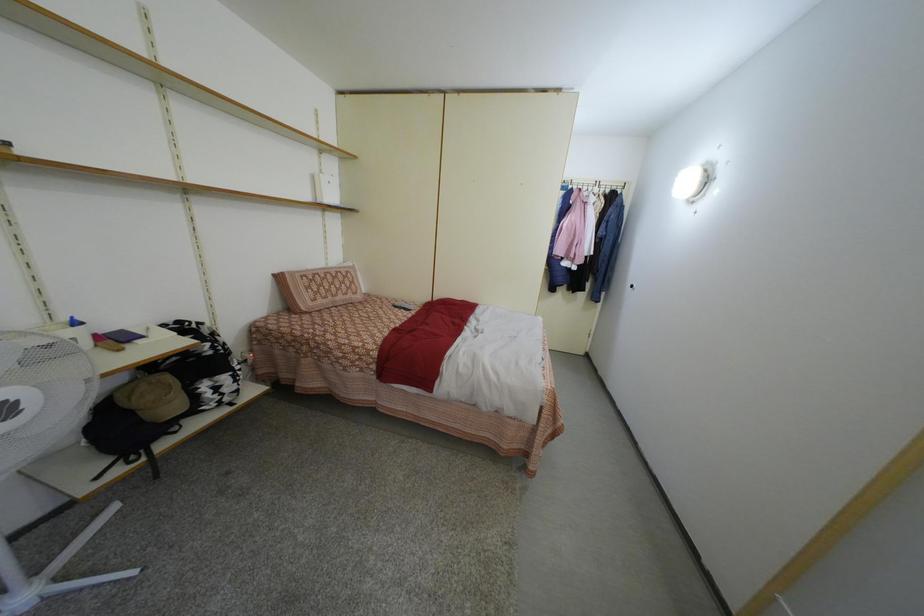
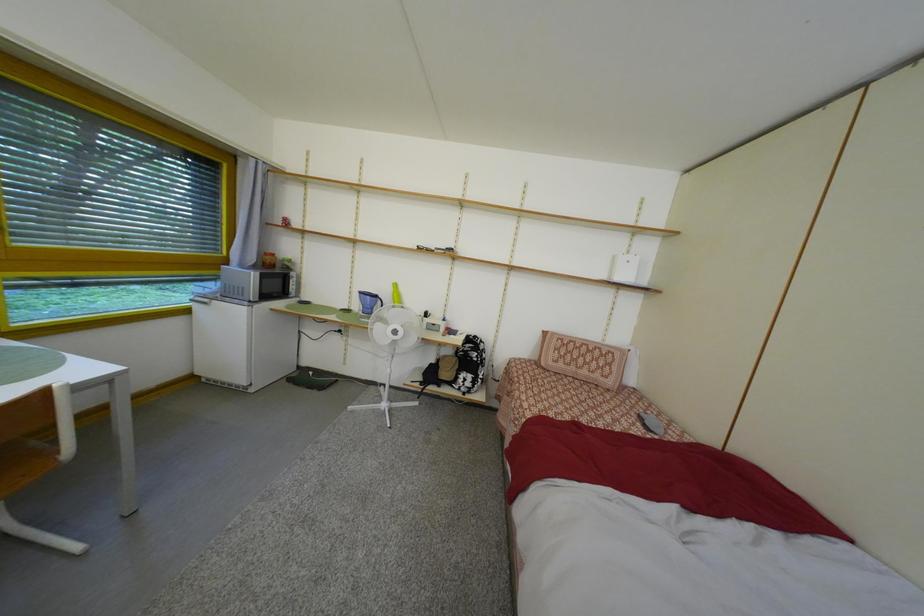
Question: The camera is either moving clockwise (left) or counter-clockwise (right) around the object. The first image is from the beginning of the video and the second image is from the end. Is the camera moving left or right when shooting the video?

Choices:
 (A) Left
 (B) Right

Answer: (B)